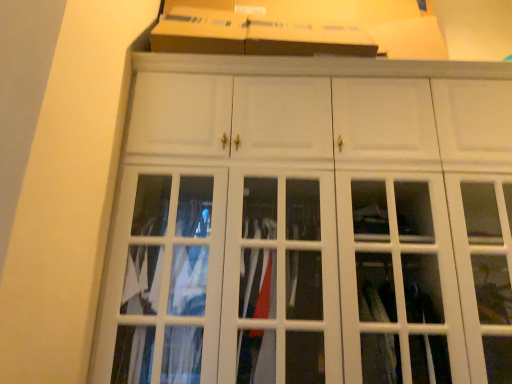
The width and height of the screenshot is (512, 384). What do you see at coordinates (309, 222) in the screenshot?
I see `white matte cabinet at center` at bounding box center [309, 222].

Where is `white matte cabinet at center`? white matte cabinet at center is located at coordinates (309, 222).

Where is `white matte cabinet at center`? This screenshot has width=512, height=384. white matte cabinet at center is located at coordinates (309, 222).